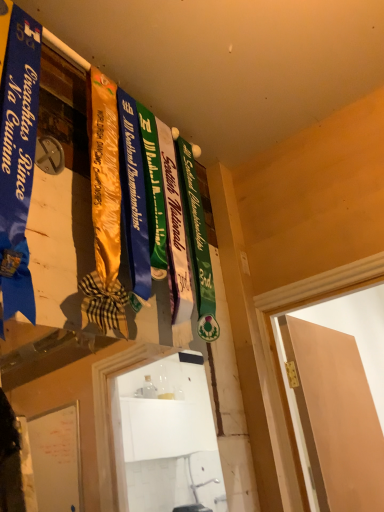
Question: Does matte peach door at right have a greater width compared to blue satin ribbon at left?

Choices:
 (A) no
 (B) yes

Answer: (A)

Question: Is matte peach door at right positioned beyond the bounds of blue satin ribbon at left?

Choices:
 (A) no
 (B) yes

Answer: (B)

Question: Is matte peach door at right thinner than blue satin ribbon at left?

Choices:
 (A) yes
 (B) no

Answer: (A)

Question: Considering the relative sizes of matte peach door at right and blue satin ribbon at left in the image provided, is matte peach door at right smaller than blue satin ribbon at left?

Choices:
 (A) yes
 (B) no

Answer: (B)

Question: Is blue satin ribbon at left completely or partially inside matte peach door at right?

Choices:
 (A) yes
 (B) no

Answer: (B)

Question: Is matte peach door at right closer to the viewer compared to blue satin ribbon at left?

Choices:
 (A) yes
 (B) no

Answer: (B)

Question: From a real-world perspective, is blue satin ribbon at left positioned over matte peach door at right based on gravity?

Choices:
 (A) yes
 (B) no

Answer: (A)

Question: Are blue satin ribbon at left and matte peach door at right beside each other?

Choices:
 (A) no
 (B) yes

Answer: (A)

Question: Can you confirm if blue satin ribbon at left is smaller than matte peach door at right?

Choices:
 (A) no
 (B) yes

Answer: (B)

Question: Is the position of blue satin ribbon at left more distant than that of matte peach door at right?

Choices:
 (A) no
 (B) yes

Answer: (A)

Question: Is blue satin ribbon at left completely or partially outside of matte peach door at right?

Choices:
 (A) yes
 (B) no

Answer: (A)

Question: Considering the relative positions of blue satin ribbon at left and matte peach door at right in the image provided, is blue satin ribbon at left in front of matte peach door at right?

Choices:
 (A) no
 (B) yes

Answer: (B)

Question: Considering their positions, is matte peach door at right located in front of or behind blue satin ribbon at left?

Choices:
 (A) behind
 (B) front

Answer: (A)